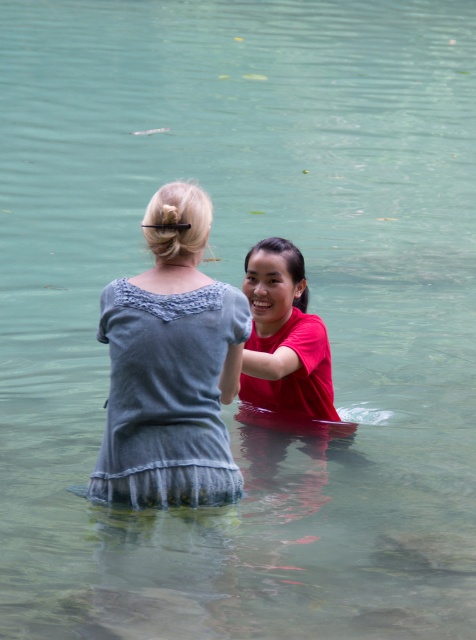
Between denim dress at center and red matte shirt at center, which one has more height?

red matte shirt at center is taller.

Is point (150, 326) positioned before point (283, 374)?

Yes, point (150, 326) is closer to viewer.

Is point (236, 294) positioned before point (253, 276)?

That is True.

Locate an element on the screen. Image resolution: width=476 pixels, height=640 pixels. denim dress at center is located at coordinates (168, 396).